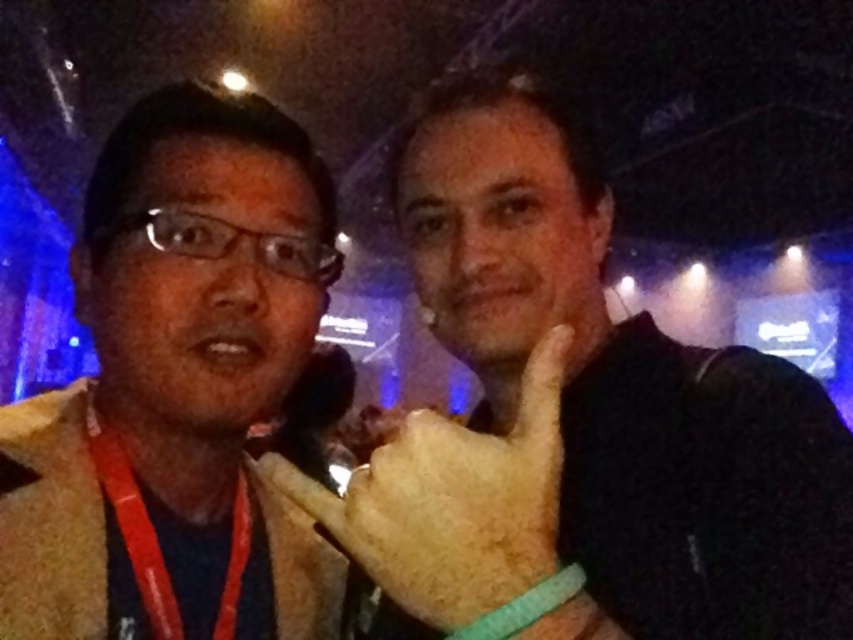
You are standing at the front of the stage at a nighttime event. You need to take a photo of the two people in the image. The camera you are using has a minimum focus distance of 24 inches. Will the point at point (292, 221) be in focus?

The distance between point (292, 221) and the viewer is 23.41 inches, which is less than the camera minimum focus distance of 24 inches. Therefore, the point at point (292, 221) will not be in focus.

You are standing in front of the two people in the photo. You want to place a small sticker on the point that is closer to you. Which point should you choose between point [465,502] and point [137,518]?

Point [465,502] is closer to the viewer, so you should choose point [465,502] to place the sticker.